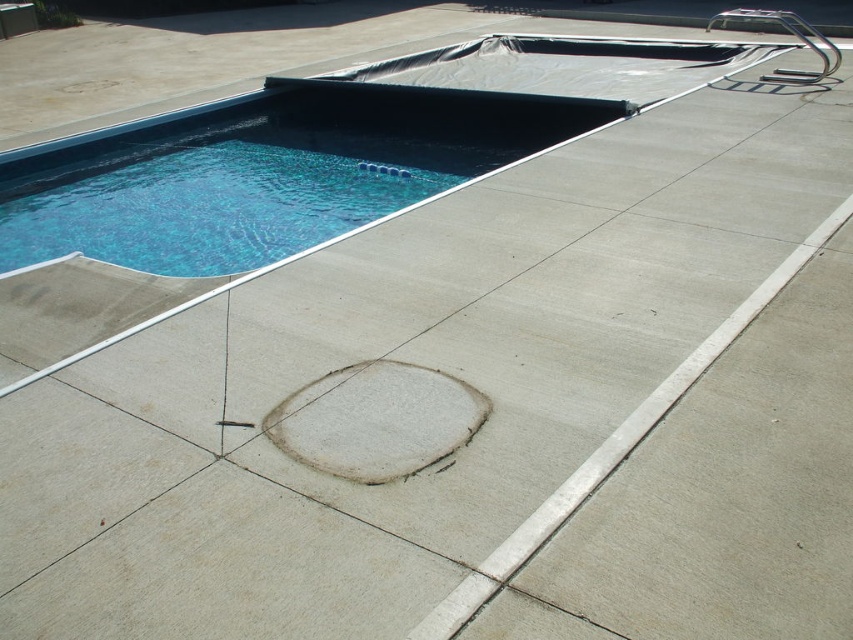
Question: Which point appears farthest from the camera in this image?

Choices:
 (A) (282, 148)
 (B) (764, 10)

Answer: (B)

Question: Does blue smooth pool at upper left have a lesser width compared to polished stainless steel ladder at upper right?

Choices:
 (A) yes
 (B) no

Answer: (B)

Question: From the image, what is the correct spatial relationship of blue smooth pool at upper left in relation to polished stainless steel ladder at upper right?

Choices:
 (A) left
 (B) right

Answer: (A)

Question: Is the position of blue smooth pool at upper left less distant than that of polished stainless steel ladder at upper right?

Choices:
 (A) yes
 (B) no

Answer: (A)